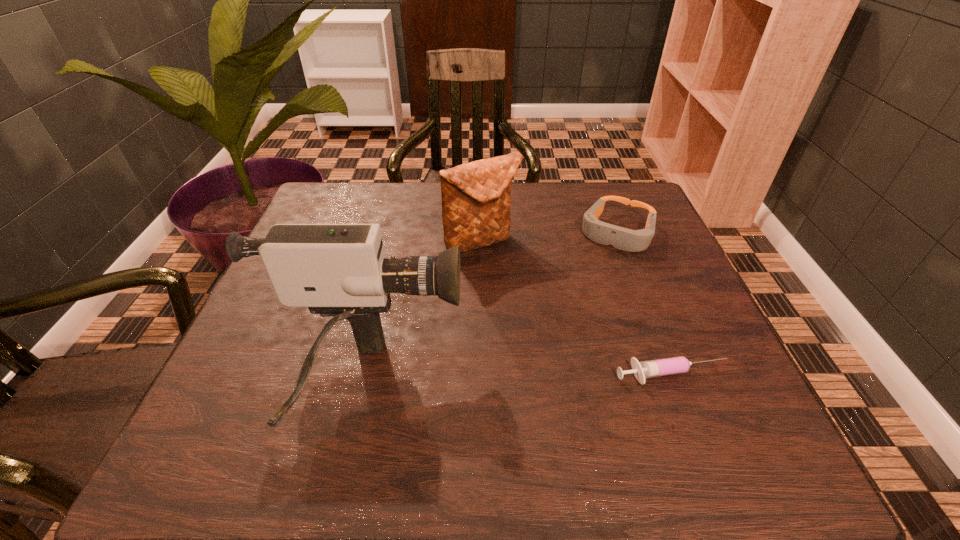
Where is `vacant space that satisfies the following two spatial constraints: 1. on the back side of the shortest object; 2. on the right side of the goggles`? vacant space that satisfies the following two spatial constraints: 1. on the back side of the shortest object; 2. on the right side of the goggles is located at coordinates (617, 233).